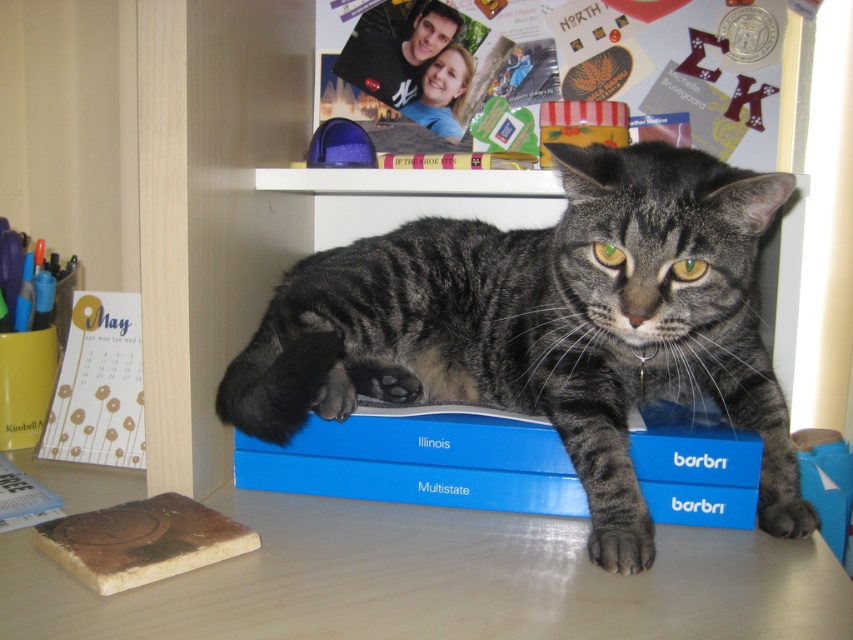
You are a photographer trying to capture a closeup of the gray tabby cat at center. According to the coordinates given, where should you position your camera to ensure the cat is centered in the frame?

The gray tabby cat at center is located at coordinates point (548, 326), so positioning the camera to focus on that point will center the cat in the frame.

You need to place a new item on the desk. The item requires a surface area larger than the gold paper calendar at left. Can the blue matte box at center accommodate it?

The blue matte box at center has a larger width than the gold paper calendar at left, so it can accommodate the item needing a surface area larger than the gold paper calendar at left.

You are organizing a space for a cat. The gray tabby cat at center needs a place to rest. Can the wooden table at lower center accommodate the cat comfortably?

The gray tabty cat at center is thinner than the wooden table at lower center, so the wooden table at lower center can accommodate the cat comfortably.